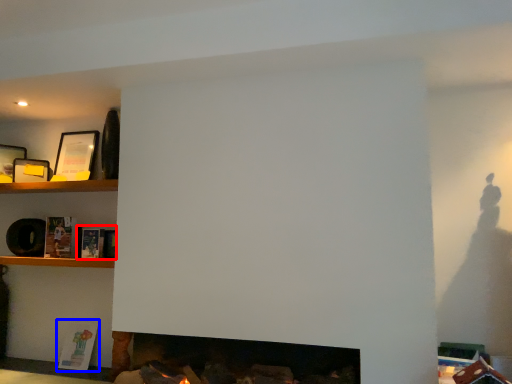
Question: Which object appears farthest to the camera in this image, book (highlighted by a red box) or book (highlighted by a blue box)?

Choices:
 (A) book
 (B) book

Answer: (B)